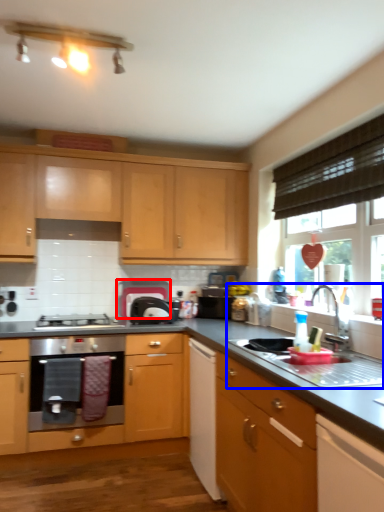
Question: Among these objects, which one is nearest to the camera, appliance (highlighted by a red box) or sink (highlighted by a blue box)?

Choices:
 (A) appliance
 (B) sink

Answer: (B)